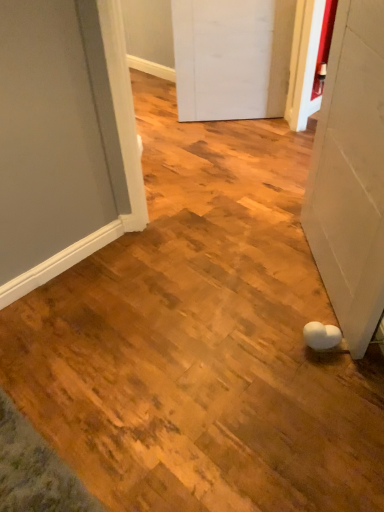
You are a GUI agent. You are given a task and a screenshot of the screen. Output one action in this format:
    pyautogui.click(x=<x>, y=<y>)
    Task: Click on the free region under white matte door at center, marked as the first door in a top-to-bottom arrangement (from a real-world perspective)
    This screenshot has height=512, width=384.
    Given the screenshot: What is the action you would take?
    pyautogui.click(x=236, y=119)